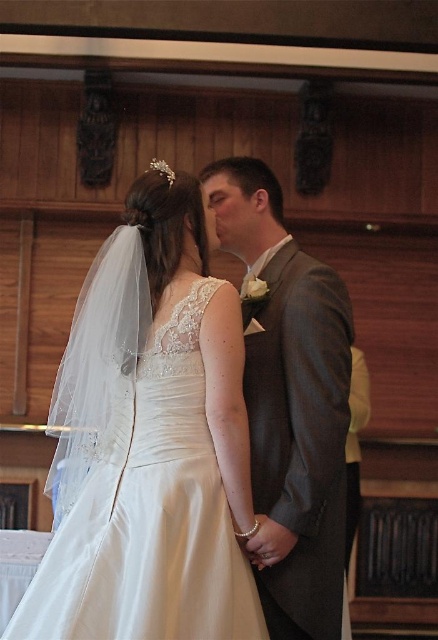
You are a photographer positioned at the back of the venue. You need to frame both the white satin dress at center and the gray textured suit at center in a single shot. Based on their widths, which one should you adjust your camera angle to focus on first to ensure both are fully visible?

The white satin dress at center might be wider than the gray textured suit at center, so you should focus on the white satin dress at center first to ensure its full width is captured before adjusting for the gray textured suit at center.

You are a photographer at the wedding ceremony. You need to capture a full body shot of the bride in the white satin dress at center and the groom in the gray textured suit at center. Which one of them should you ask to stand slightly closer to the camera to ensure both are fully visible in the frame?

Since the white satin dress at center is shorter than the gray textured suit at center, the bride in the white satin dress at center should stand slightly closer to the camera to ensure both are fully visible in the frame.